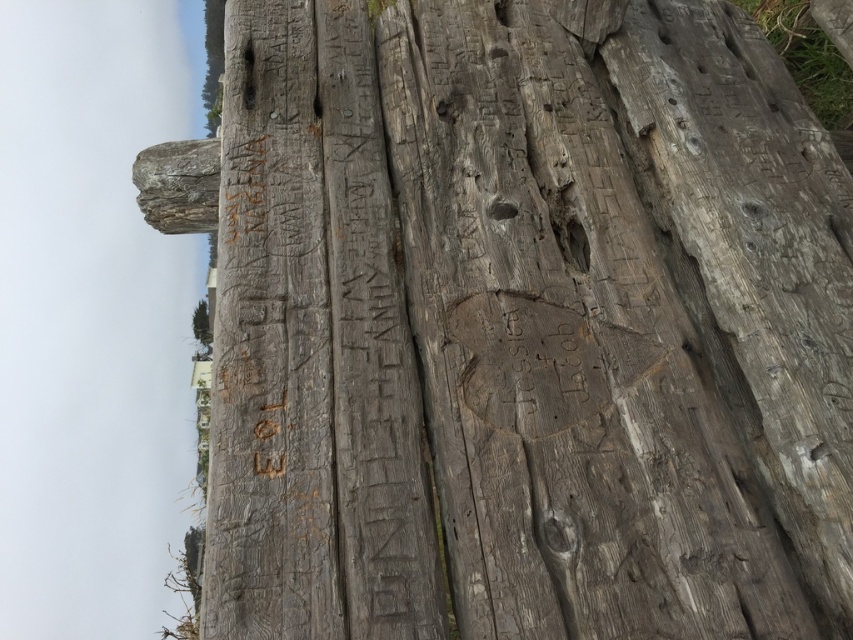
Question: From the image, what is the correct spatial relationship of smooth gray tree trunk at upper center in relation to green leafy tree at upper left?

Choices:
 (A) below
 (B) above

Answer: (B)

Question: Considering the relative positions of smooth gray tree trunk at upper center and green leafy tree at upper left in the image provided, where is smooth gray tree trunk at upper center located with respect to green leafy tree at upper left?

Choices:
 (A) above
 (B) below

Answer: (A)

Question: Which of the following is the farthest from the observer?

Choices:
 (A) (206, 316)
 (B) (216, 29)

Answer: (B)

Question: Among these objects, which one is nearest to the camera?

Choices:
 (A) smooth gray tree trunk at upper center
 (B) green leafy tree at upper left

Answer: (A)

Question: Where is smooth gray tree trunk at upper center located in relation to green leafy tree at upper left in the image?

Choices:
 (A) above
 (B) below

Answer: (A)